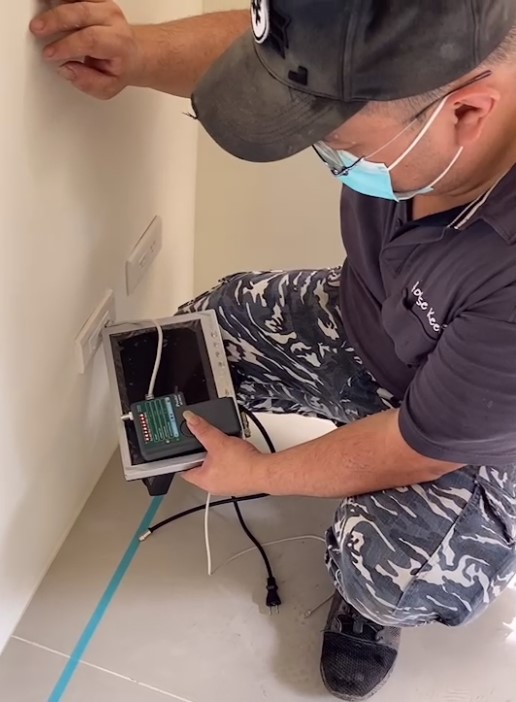
This screenshot has width=516, height=702. Identify the location of white grout line on floor. pos(124,674).